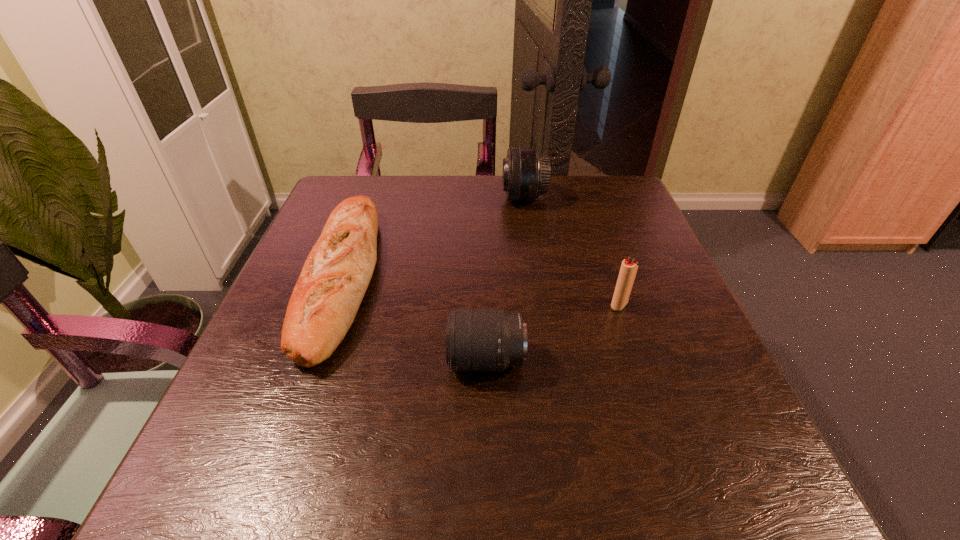
Identify the location of free space that is in between the farthest object and the igniter. (571, 252).

This screenshot has width=960, height=540. In order to click on free spot between the farther telephoto lens and the leftmost object in this screenshot , I will do `click(434, 238)`.

This screenshot has height=540, width=960. I want to click on vacant area that lies between the igniter and the taller telephoto lens, so click(571, 252).

The width and height of the screenshot is (960, 540). I want to click on free space between the farther telephoto lens and the baguet, so click(x=434, y=238).

Identify the location of free point between the leftmost object and the igniter. (481, 292).

What are the coordinates of `object that is the closest to the igniter` in the screenshot? It's located at (476, 339).

The width and height of the screenshot is (960, 540). Identify the location of object that stands as the third closest to the igniter. (336, 274).

You are a GUI agent. You are given a task and a screenshot of the screen. Output one action in this format:
    pyautogui.click(x=<x>, y=<y>)
    Task: Click on the vacant space that satisfies the following two spatial constraints: 1. on the front-facing side of the rightmost object; 2. on the right side of the taller telephoto lens
    The width and height of the screenshot is (960, 540).
    Given the screenshot: What is the action you would take?
    pyautogui.click(x=540, y=305)

What are the coordinates of `free location that satisfies the following two spatial constraints: 1. on the front-facing side of the farther telephoto lens; 2. on the right side of the rightmost object` in the screenshot? It's located at (540, 305).